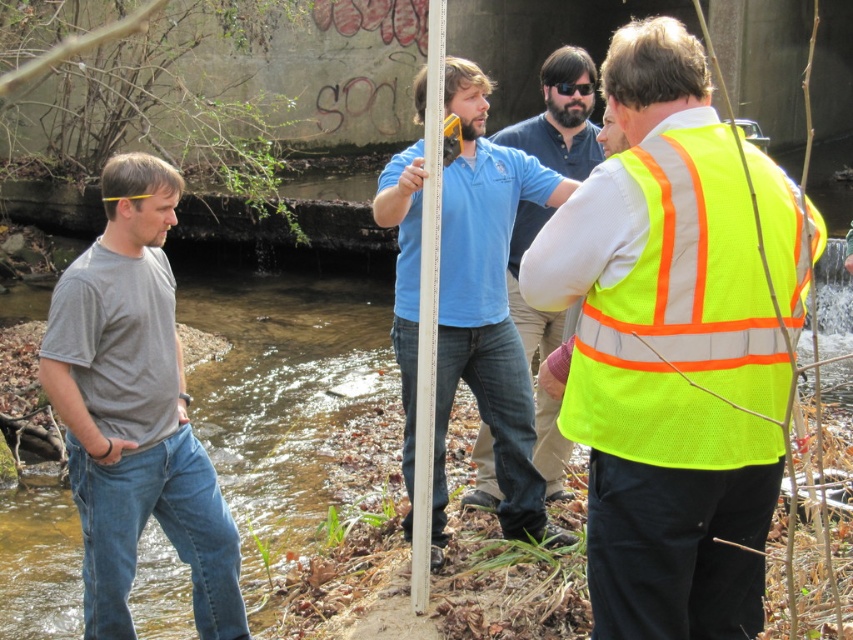
Question: Is matte blue shirt at center further to the viewer compared to neon yellow safety vest at center?

Choices:
 (A) no
 (B) yes

Answer: (A)

Question: Which point appears closest to the camera in this image?

Choices:
 (A) (502, 145)
 (B) (572, 93)
 (C) (631, 452)
 (D) (135, 445)

Answer: (C)

Question: Is matte blue shirt at center below black plastic goggles at center?

Choices:
 (A) no
 (B) yes

Answer: (B)

Question: Which of the following is the closest to the observer?

Choices:
 (A) (434, 230)
 (B) (755, 323)
 (C) (103, 406)
 (D) (578, 86)

Answer: (B)

Question: Is matte blue shirt at center bigger than white plastic pole at center?

Choices:
 (A) no
 (B) yes

Answer: (B)

Question: Considering the real-world distances, which object is closest to the white plastic pole at center?

Choices:
 (A) neon yellow mesh safety vest at right
 (B) black plastic goggles at center

Answer: (B)